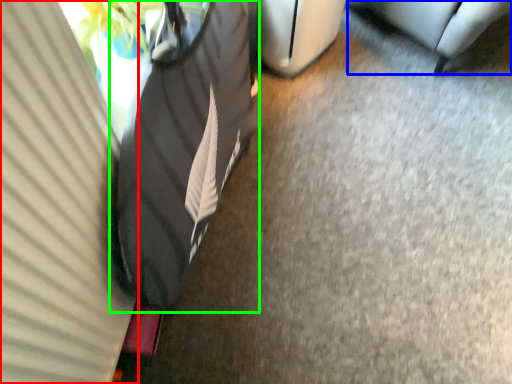
Question: Which is nearer to the curtain (highlighted by a red box)? furniture (highlighted by a blue box) or bean bag chair (highlighted by a green box).

Choices:
 (A) furniture
 (B) bean bag chair

Answer: (B)